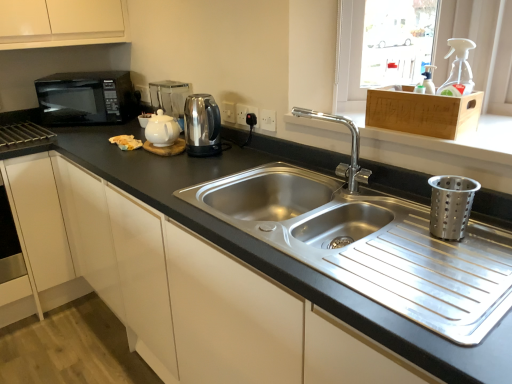
Image resolution: width=512 pixels, height=384 pixels. Describe the element at coordinates (423, 112) in the screenshot. I see `wooden crate at upper right` at that location.

I want to click on black matte microwave at left, so click(x=87, y=98).

The width and height of the screenshot is (512, 384). I want to click on polished stainless steel faucet at center, so tap(351, 149).

This screenshot has height=384, width=512. What do you see at coordinates (272, 247) in the screenshot?
I see `black granite countertop at center` at bounding box center [272, 247].

I want to click on white glossy tea pot at center, so click(162, 130).

This screenshot has height=384, width=512. Find the location of `stainless steel kettle at center`. stainless steel kettle at center is located at coordinates (202, 125).

Considering the relative sizes of black matte microwave at left and white glossy tea pot at center in the image provided, is black matte microwave at left wider than white glossy tea pot at center?

Indeed, black matte microwave at left has a greater width compared to white glossy tea pot at center.

In the scene shown: Is black matte microwave at left in front of or behind white glossy tea pot at center in the image?

In the image, black matte microwave at left appears behind white glossy tea pot at center.

How many degrees apart are the facing directions of black matte microwave at left and white glossy tea pot at center?

The angular difference between black matte microwave at left and white glossy tea pot at center is 59.4 degrees.

Is black matte microwave at left inside the boundaries of white glossy tea pot at center, or outside?

The correct answer is: outside.

Is metallic silver coffee machine at upper center not within wooden crate at upper right?

Absolutely, metallic silver coffee machine at upper center is external to wooden crate at upper right.

Does metallic silver coffee machine at upper center come in front of wooden crate at upper right?

That is False.

Identify the location of coffee machine that is under the wooden crate at upper right (from a real-world perspective). The image size is (512, 384). (169, 96).

Is wooden crate at upper right not inside white glossy tea pot at center?

Yes.

Does wooden crate at upper right lie in front of white glossy tea pot at center?

Yes, wooden crate at upper right is closer to the camera.

Are wooden crate at upper right and white glossy tea pot at center beside each other?

They are not placed beside each other.

Is wooden crate at upper right taller or shorter than black matte microwave at left?

In the image, wooden crate at upper right appears to be shorter than black matte microwave at left.

Looking at this image, do you think wooden crate at upper right is within black matte microwave at left, or outside of it?

wooden crate at upper right is spatially situated outside black matte microwave at left.

Does point (370, 128) come behind point (66, 89)?

No, (370, 128) is closer to viewer.

Is wooden crate at upper right in contact with black matte microwave at left?

wooden crate at upper right and black matte microwave at left are clearly separated.

From a real-world perspective, between black granite countertop at center and metallic silver coffee machine at upper center, who is vertically lower?

From a 3D spatial view, black granite countertop at center is below.

Would you say black granite countertop at center is outside metallic silver coffee machine at upper center?

Indeed, black granite countertop at center is completely outside metallic silver coffee machine at upper center.

Is black granite countertop at center turned away from metallic silver coffee machine at upper center?

black granite countertop at center is not turned away from metallic silver coffee machine at upper center.

The height and width of the screenshot is (384, 512). In the image, there is a black granite countertop at center. Find the location of `coffee machine above it (from the image's perspective)`. coffee machine above it (from the image's perspective) is located at coordinates (169, 96).

Which point is more distant from viewer, (x=352, y=193) or (x=378, y=107)?

The point (x=352, y=193) is more distant.

Is polished stainless steel faucet at center aimed at wooden crate at upper right?

No, polished stainless steel faucet at center is not turned towards wooden crate at upper right.

Is polished stainless steel faucet at center in front of or behind wooden crate at upper right in the image?

polished stainless steel faucet at center is behind wooden crate at upper right.

From a real-world perspective, is polished stainless steel faucet at center located beneath wooden crate at upper right?

Correct, in the physical world, polished stainless steel faucet at center is lower than wooden crate at upper right.

Where is `countertop to the right of stainless steel kettle at center`? Image resolution: width=512 pixels, height=384 pixels. countertop to the right of stainless steel kettle at center is located at coordinates (272, 247).

Considering the relative sizes of black granite countertop at center and stainless steel kettle at center in the image provided, is black granite countertop at center taller than stainless steel kettle at center?

Correct, black granite countertop at center is much taller as stainless steel kettle at center.

From the image's perspective, relative to stainless steel kettle at center, is black granite countertop at center above or below?

Clearly, from the image's perspective, black granite countertop at center is below stainless steel kettle at center.

From a real-world perspective, who is located lower, black granite countertop at center or stainless steel kettle at center?

black granite countertop at center, from a real-world perspective.

Where is `microwave oven lying behind the white glossy tea pot at center`? The width and height of the screenshot is (512, 384). microwave oven lying behind the white glossy tea pot at center is located at coordinates (87, 98).

Locate an element on the screen. This screenshot has width=512, height=384. window sill below the metallic silver coffee machine at upper center (from the image's perspective) is located at coordinates (455, 140).

Which object lies nearer to the anchor point stainless steel kettle at center, wooden crate at upper right or black granite countertop at center?

black granite countertop at center is positioned closer to the anchor stainless steel kettle at center.

Which object lies nearer to the anchor point wooden crate at upper right, polished stainless steel faucet at center or metallic silver coffee machine at upper center?

polished stainless steel faucet at center.

Looking at the image, which one is located further to polished stainless steel faucet at center, black granite countertop at center or white glossy tea pot at center?

white glossy tea pot at center is further to polished stainless steel faucet at center.

Considering their positions, is white glossy tea pot at center positioned closer to metallic silver coffee machine at upper center than wooden crate at upper right?

white glossy tea pot at center.

Considering their positions, is wooden crate at upper right positioned closer to black matte microwave at left than metallic silver coffee machine at upper center?

metallic silver coffee machine at upper center is positioned closer to the anchor black matte microwave at left.

Estimate the real-world distances between objects in this image. Which object is further from wooden crate at upper right, black matte microwave at left or black granite countertop at center?

Among the two, black matte microwave at left is located further to wooden crate at upper right.

Estimate the real-world distances between objects in this image. Which object is further from stainless steel kettle at center, wooden crate at upper right or metallic silver coffee machine at upper center?

The object further to stainless steel kettle at center is wooden crate at upper right.

Based on their spatial positions, is wooden crate at upper right or black granite countertop at center closer to wooden crate at upper right?

wooden crate at upper right.

Where is `coffee machine between black matte microwave at left and polished stainless steel faucet at center`? coffee machine between black matte microwave at left and polished stainless steel faucet at center is located at coordinates (169, 96).

Find the location of a particular element. Image resolution: width=512 pixels, height=384 pixels. tap between black matte microwave at left and wooden crate at upper right in the horizontal direction is located at coordinates (351, 149).

The width and height of the screenshot is (512, 384). I want to click on window sill between black granite countertop at center and stainless steel kettle at center in the front-back direction, so click(x=455, y=140).

Identify the location of tap between stainless steel kettle at center and wooden crate at upper right in the horizontal direction. (351, 149).